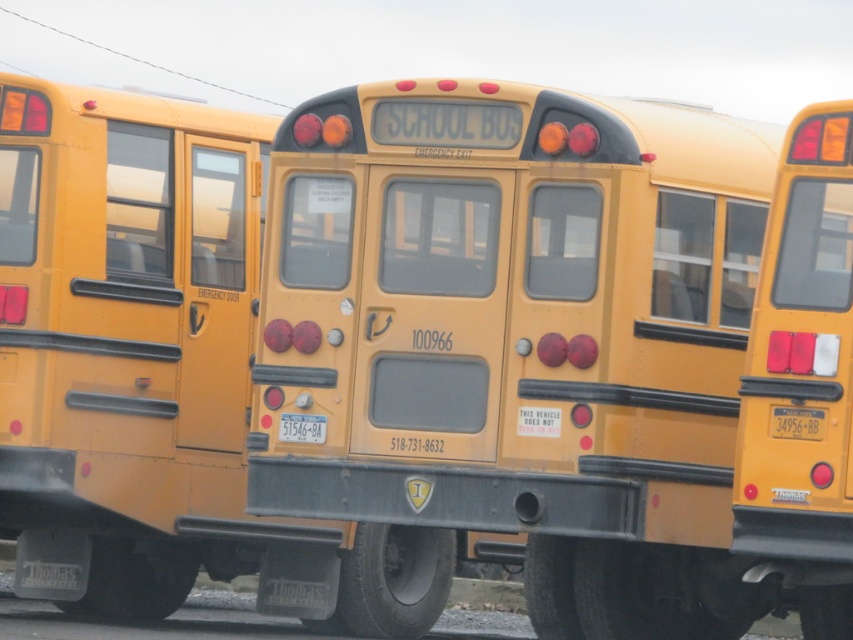
Question: Can you confirm if yellow matte/solid school bus at center is smaller than yellow matte license plate at center?

Choices:
 (A) no
 (B) yes

Answer: (A)

Question: Which of the following is the farthest from the observer?

Choices:
 (A) yellow plastic license plate at center
 (B) yellow matte license plate at center

Answer: (B)

Question: Does yellow matte/solid school bus at center lie behind yellow plastic license plate at center?

Choices:
 (A) yes
 (B) no

Answer: (A)

Question: Can you confirm if yellow plastic license plate at center is positioned below yellow matte license plate at center?

Choices:
 (A) yes
 (B) no

Answer: (B)

Question: Estimate the real-world distances between objects in this image. Which object is farther from the yellow matte/solid school bus at center?

Choices:
 (A) yellow matte license plate at center
 (B) yellow plastic license plate at center

Answer: (B)

Question: Which of the following is the closest to the observer?

Choices:
 (A) yellow matte license plate at center
 (B) yellow plastic license plate at center

Answer: (B)